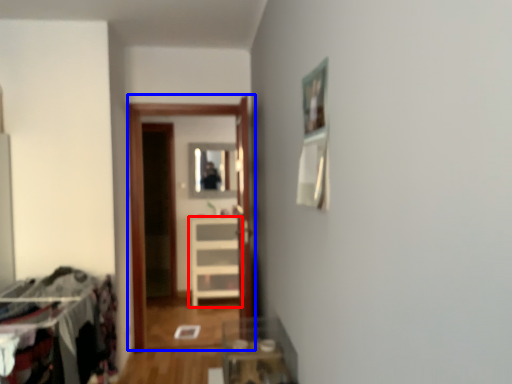
Question: Which object is further to the camera taking this photo, furniture (highlighted by a red box) or glass door (highlighted by a blue box)?

Choices:
 (A) furniture
 (B) glass door

Answer: (A)